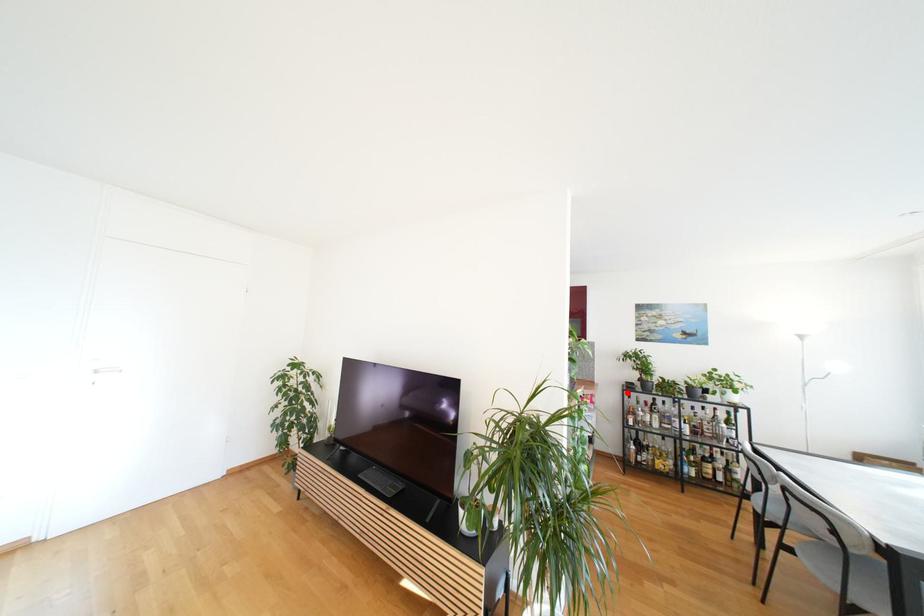
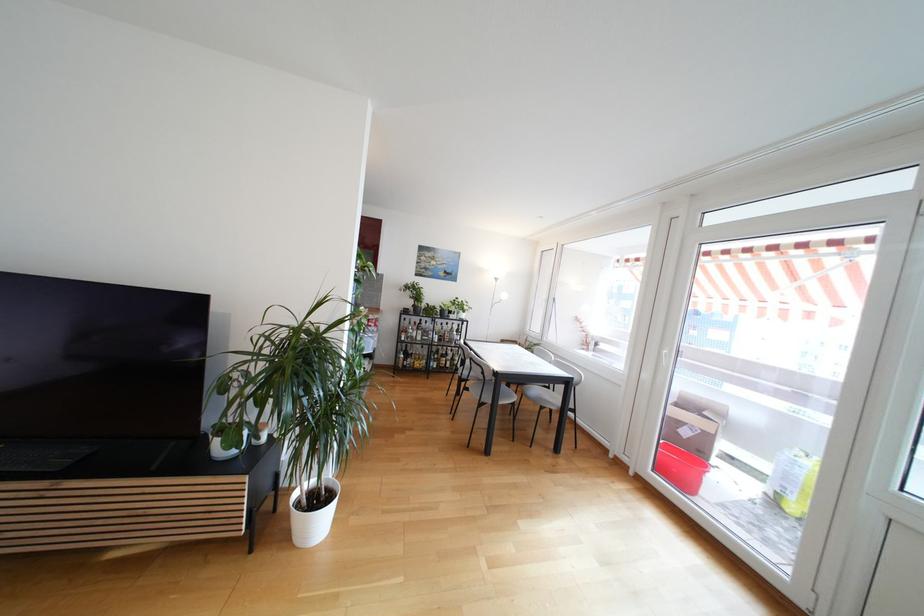
Where in the second image is the point corresponding to the highlighted location from the first image?

(405, 315)